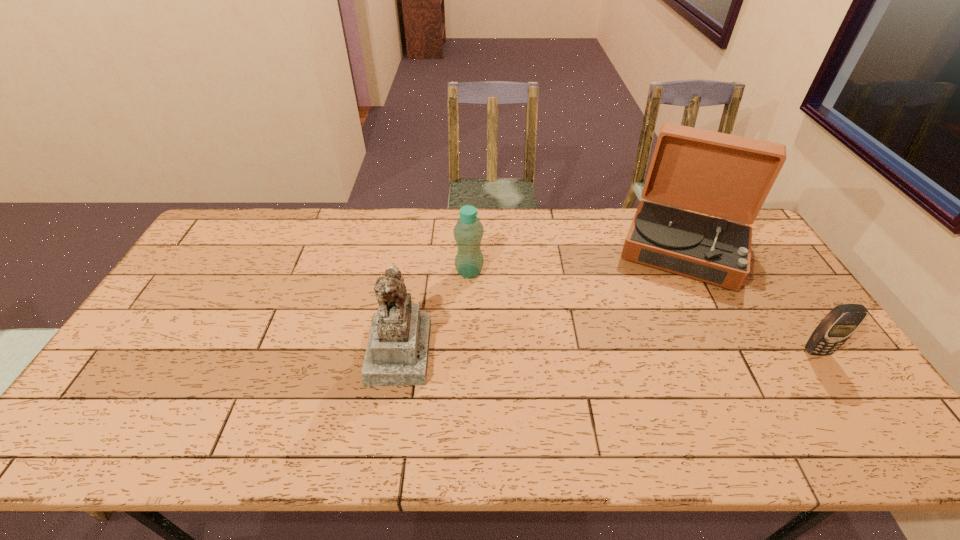
The height and width of the screenshot is (540, 960). In order to click on vacant space located 0.270m at the front cap of the second shortest object in this screenshot , I will do `click(540, 332)`.

Find the location of `vacant area situated 0.090m at the front cap of the second shortest object`. vacant area situated 0.090m at the front cap of the second shortest object is located at coordinates click(497, 296).

Image resolution: width=960 pixels, height=540 pixels. In order to click on vacant space positioned 0.150m at the front cap of the second shortest object in this screenshot , I will do `click(511, 307)`.

This screenshot has width=960, height=540. I want to click on object positioned at the far edge, so click(x=727, y=176).

The width and height of the screenshot is (960, 540). I want to click on object that is at the near edge, so click(x=397, y=354).

The width and height of the screenshot is (960, 540). I want to click on cellular telephone present at the right edge, so click(842, 321).

The width and height of the screenshot is (960, 540). Identify the location of phonograph record positioned at the right edge. (x=727, y=176).

What are the coordinates of `object located in the far right corner section of the desktop` in the screenshot? It's located at (727, 176).

The image size is (960, 540). I want to click on free space at the far edge of the desktop, so click(x=513, y=230).

You are a GUI agent. You are given a task and a screenshot of the screen. Output one action in this format:
    pyautogui.click(x=<x>, y=<y>)
    Task: Click on the vacant region at the near edge of the desktop
    The height and width of the screenshot is (540, 960).
    Given the screenshot: What is the action you would take?
    point(244,381)